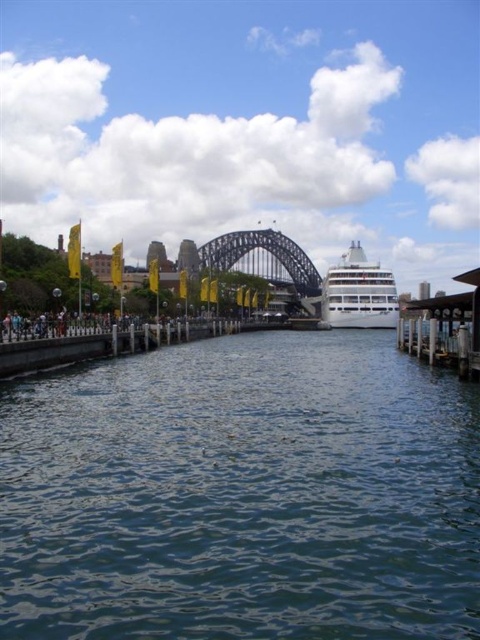
Can you confirm if blue water at center is wider than white glossy cruise ship at center?

Yes.

I want to click on blue water at center, so click(241, 493).

Does blue water at center appear over dark gray steel bridge at center?

Actually, blue water at center is below dark gray steel bridge at center.

Find the location of a particular element. blue water at center is located at coordinates (241, 493).

Who is more distant from viewer, (x=211, y=266) or (x=346, y=282)?

Positioned behind is point (x=211, y=266).

From the picture: Is dark gray steel bridge at center in front of white glossy cruise ship at center?

No, it is not.

Who is more forward, (244,236) or (396,317)?

Positioned in front is point (396,317).

Locate an element on the screen. dark gray steel bridge at center is located at coordinates (262, 259).